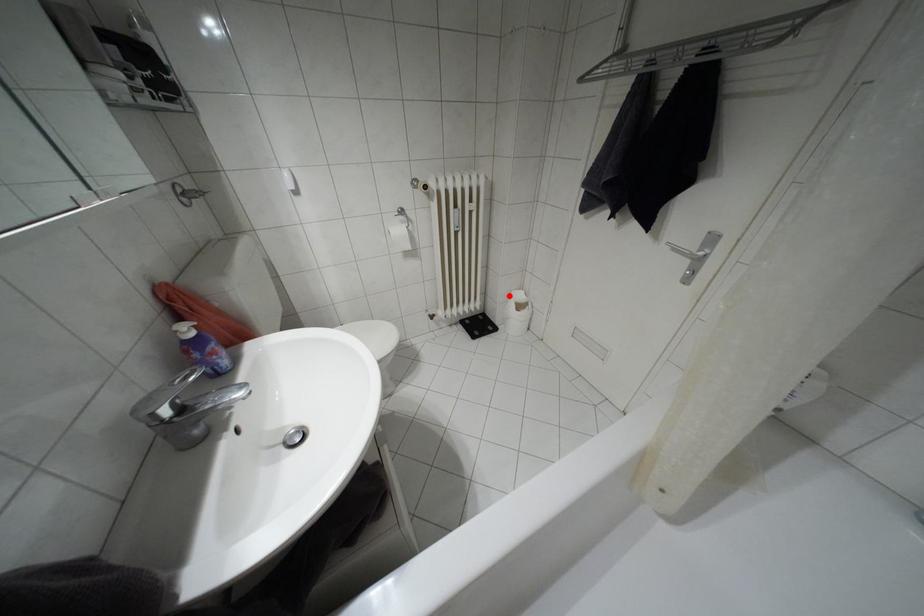
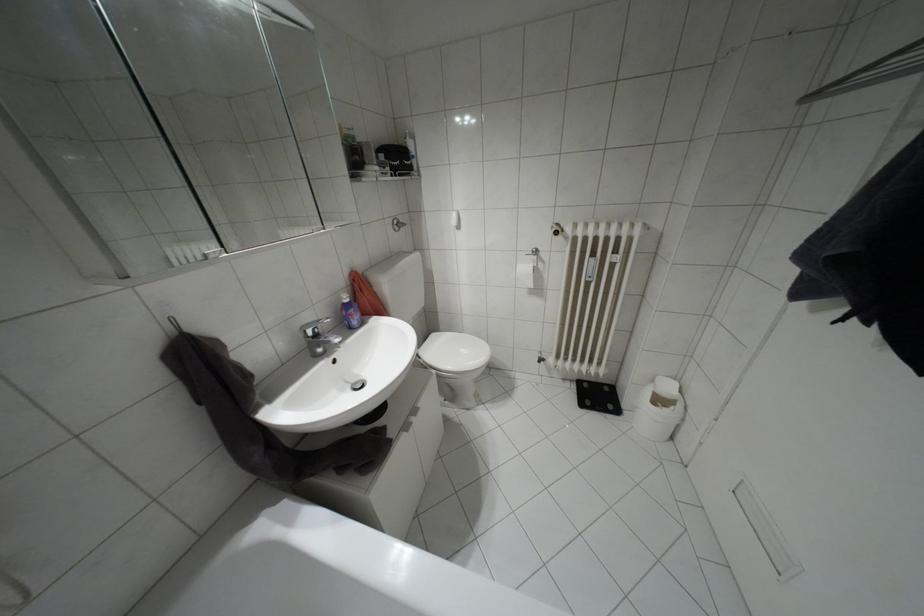
Find the pixel in the second image that matches the highlighted location in the first image.

(652, 379)